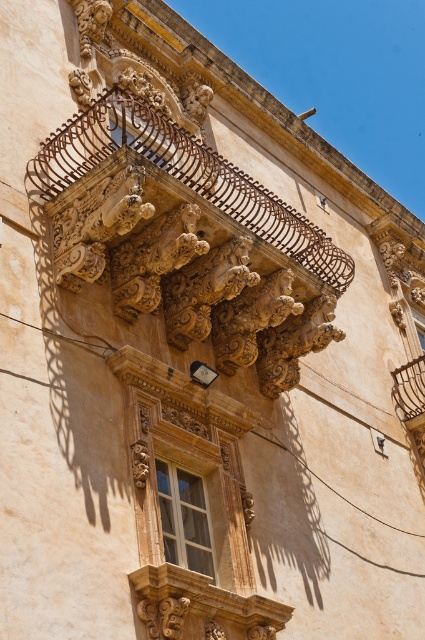
Question: Can you confirm if carved stone balcony at upper center is positioned to the right of matte wood window at center?

Choices:
 (A) no
 (B) yes

Answer: (B)

Question: Which object is closer to the camera taking this photo?

Choices:
 (A) carved stone balcony at upper center
 (B) matte wood window at center

Answer: (B)

Question: Does carved stone balcony at upper center appear on the right side of matte wood window at center?

Choices:
 (A) yes
 (B) no

Answer: (A)

Question: Does carved stone balcony at upper center have a larger size compared to matte wood window at center?

Choices:
 (A) yes
 (B) no

Answer: (A)

Question: Which point is farther from the camera taking this photo?

Choices:
 (A) (336, 257)
 (B) (206, 509)

Answer: (A)